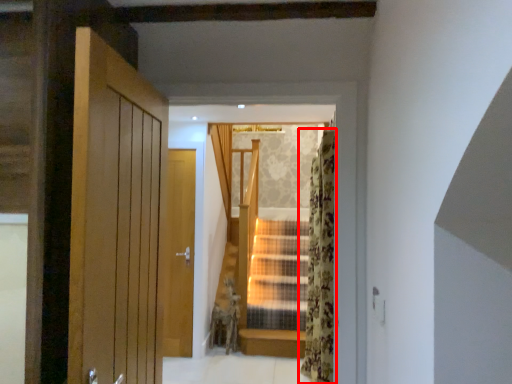
Question: From the image's perspective, what is the correct spatial positioning of curtain (annotated by the red box) in reference to curtain?

Choices:
 (A) above
 (B) below

Answer: (B)